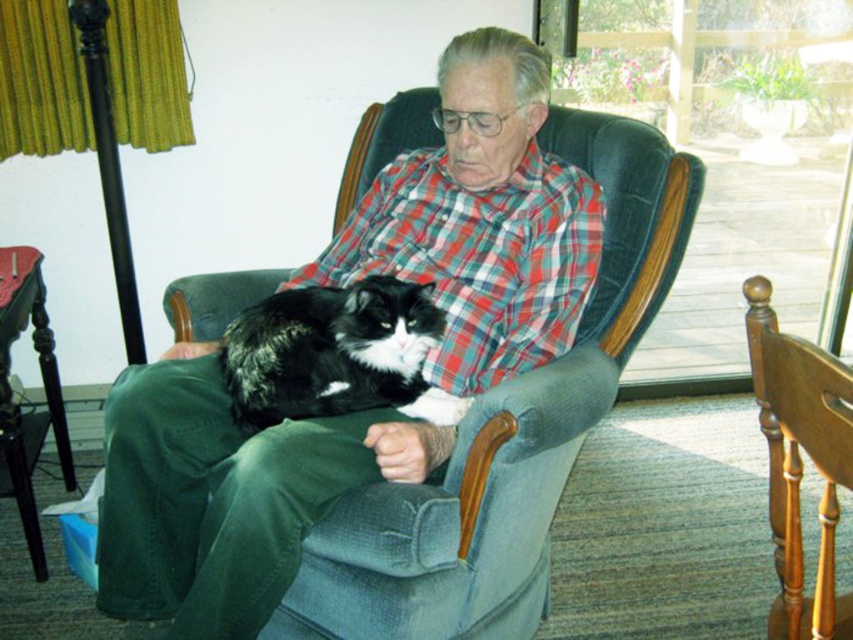
At what (x,y) coordinates should I click in order to perform the action: click on plaid cotton shirt at center. Please return your answer as a coordinate pair (x, y). This screenshot has height=640, width=853. Looking at the image, I should click on (225, 493).

Between plaid cotton shirt at center and wooden chair at center, which one appears on the right side from the viewer's perspective?

Positioned to the right is wooden chair at center.

The image size is (853, 640). Find the location of `plaid cotton shirt at center`. plaid cotton shirt at center is located at coordinates (225, 493).

How far apart are black fluffy cat at center and wooden chair at center?

black fluffy cat at center is 64.31 centimeters away from wooden chair at center.

Where is `black fluffy cat at center`? The height and width of the screenshot is (640, 853). black fluffy cat at center is located at coordinates (335, 353).

Who is positioned more to the left, red plaid shirt at center or wooden chair at center?

red plaid shirt at center is more to the left.

Is red plaid shirt at center to the right of wooden chair at center from the viewer's perspective?

Incorrect, red plaid shirt at center is not on the right side of wooden chair at center.

This screenshot has height=640, width=853. In order to click on red plaid shirt at center in this screenshot , I will do `click(479, 259)`.

Identify the location of red plaid shirt at center. This screenshot has width=853, height=640. (479, 259).